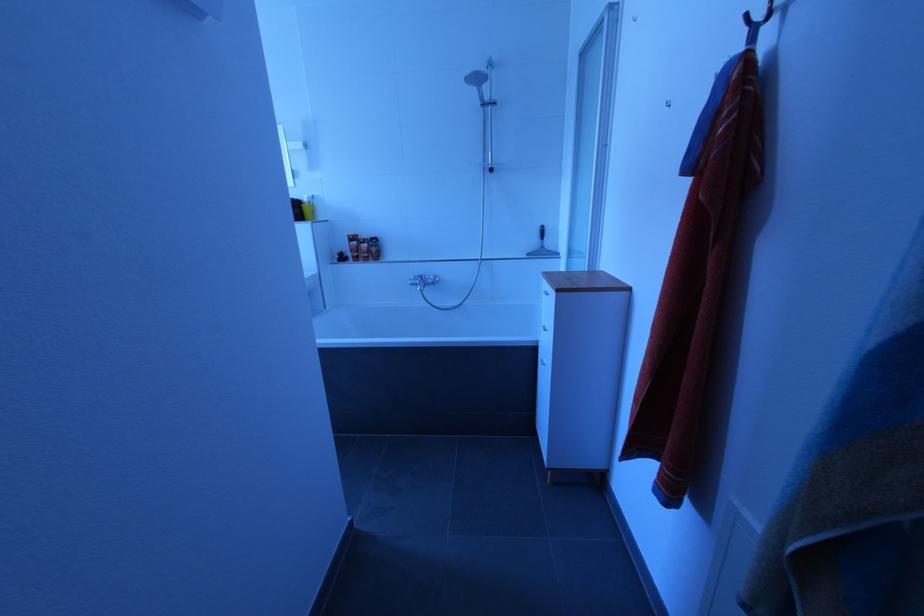
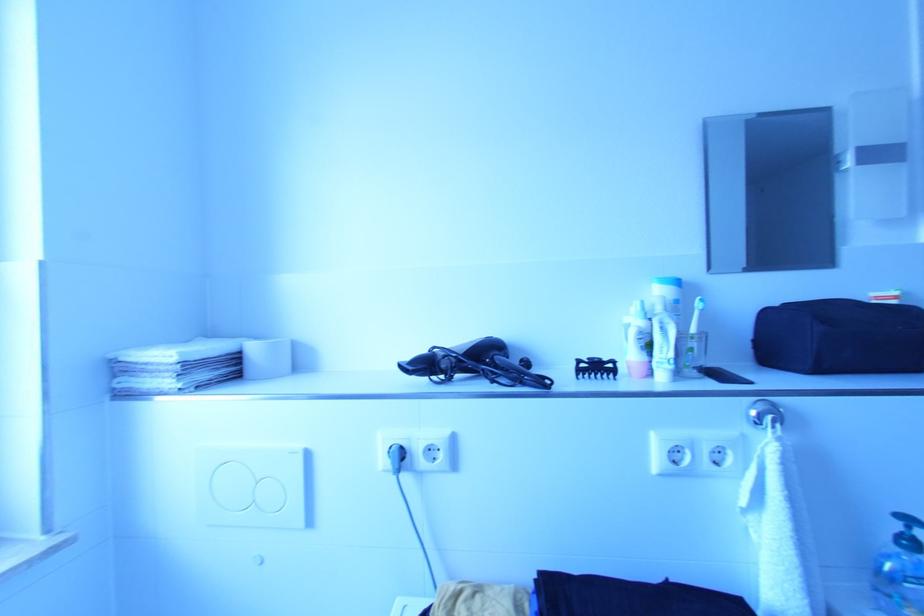
The images are taken continuously from a first-person perspective. In which direction are you moving?

The movement direction of the cameraman is left, forward.